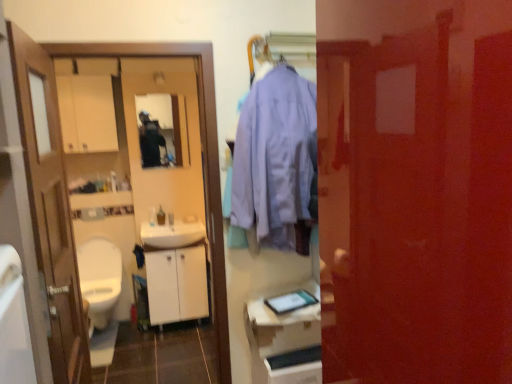
Question: Is white glossy sink at center bigger or smaller than matte black tablet at center?

Choices:
 (A) small
 (B) big

Answer: (B)

Question: Is white glossy sink at center spatially inside matte black tablet at center, or outside of it?

Choices:
 (A) inside
 (B) outside

Answer: (B)

Question: Which object is positioned closest to the translucent plastic bottle at center?

Choices:
 (A) white glossy sink at center
 (B) wooden door at left, positioned as the second door in front-to-back order
 (C) matte black tablet at center
 (D) matte black mirror at upper center
 (E) white glossy cabinet at lower center, which ranks as the first cabinetry in right-to-left order

Answer: (A)

Question: Considering the real-world distances, which object is closest to the white glossy toilet at lower left?

Choices:
 (A) white glossy sink at center
 (B) white glossy cabinet at lower center, which is the 2th cabinetry from left to right
 (C) white matte cabinet at center, the 2th cabinetry viewed from the right
 (D) translucent plastic bottle at center
 (E) matte black mirror at upper center

Answer: (C)